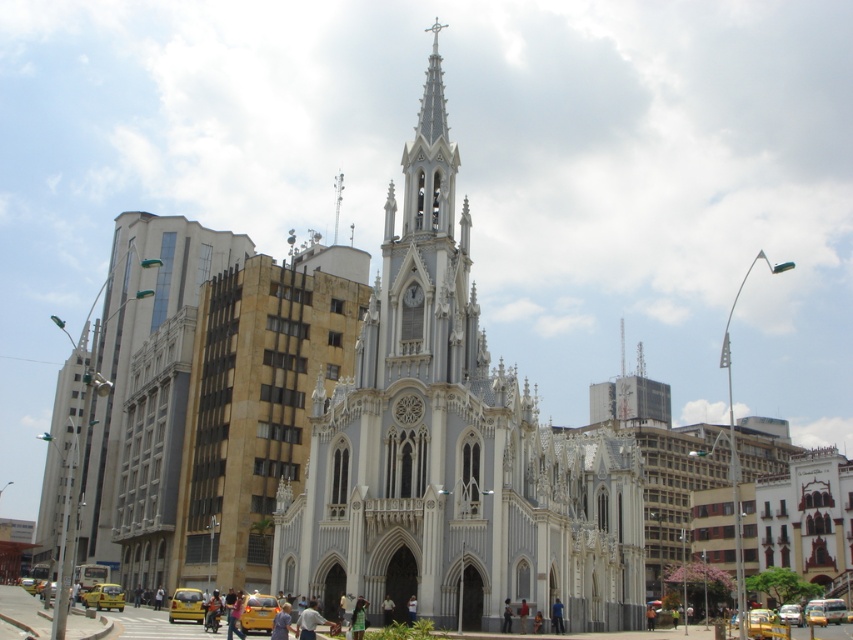
You are a city planner assessing the view of the church steeple from a new skyscraper under construction. The skyscraper will be 300 feet tall. Will the smooth white spire at upper center block the view of the white stone church steeple at center from the top floor of the skyscraper?

The distance between the white stone church steeple at center and the smooth white spire at upper center is 296.66 feet. Since the skyscraper is 300 feet tall, which is slightly taller than the distance between them, the smooth white spire at upper center may block the view of the white stone church steeple at center from the top floor of the skyscraper depending on their exact positions and angles.

You are an architect designing a new building adjacent to the white stone church steeple at center and the smooth white spire at upper center. To ensure proper spacing between your new structure and the existing spires, you need to know which of the two spires has a greater width. Which one is wider?

The white stone church steeple at center has a greater width than the smooth white spire at upper center, so you should consider its dimensions first for proper spacing.

You are an architect analyzing the church and the modern buildings around it. You notice the white stone church steeple at center and the smooth white spire at upper center. Which of these two structures is bigger in size?

The white stone church steeple at center has a larger size compared to the smooth white spire at upper center, so the white stone church steeple at center is bigger in size.